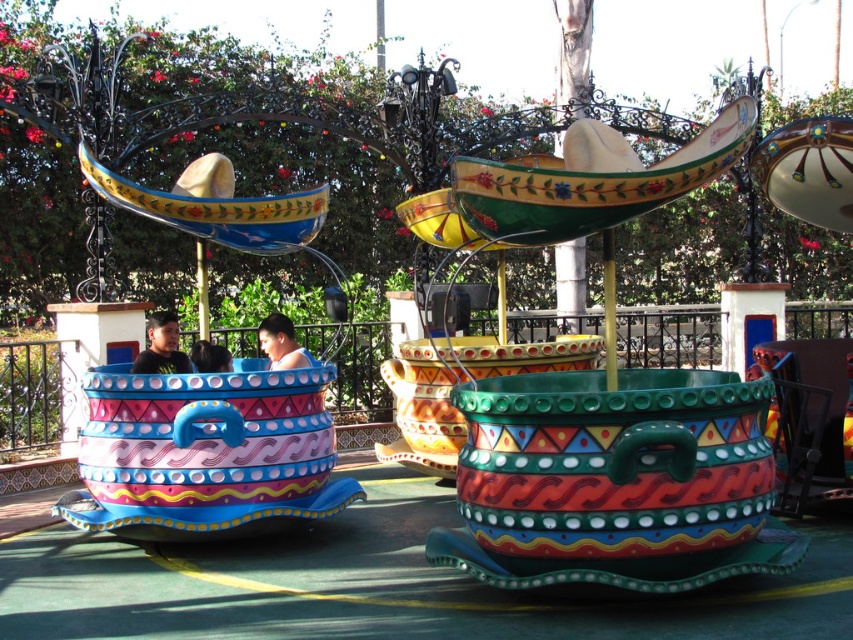
Is matte ceramic teacup at center closer to camera compared to smooth blue shirt at center?

Yes, matte ceramic teacup at center is in front of smooth blue shirt at center.

Does matte ceramic teacup at center come behind smooth blue shirt at center?

No, matte ceramic teacup at center is in front of smooth blue shirt at center.

Image resolution: width=853 pixels, height=640 pixels. Identify the location of matte ceramic teacup at center. (608, 404).

Can you confirm if matte black shirt at left is thinner than smooth blue shirt at center?

Yes, matte black shirt at left is thinner than smooth blue shirt at center.

Which is more to the right, matte black shirt at left or smooth blue shirt at center?

Positioned to the right is smooth blue shirt at center.

At what (x,y) coordinates should I click in order to perform the action: click on matte black shirt at left. Please return your answer as a coordinate pair (x, y). Looking at the image, I should click on pyautogui.click(x=161, y=346).

Which of these two, matte ceramic teacup at center or matte black shirt at left, stands taller?

matte ceramic teacup at center is taller.

Does matte ceramic teacup at center have a lesser height compared to matte black shirt at left?

No.

Consider the image. Who is more forward, (733, 534) or (166, 316)?

Point (733, 534) is in front.

Find the location of a particular element. matte ceramic teacup at center is located at coordinates (608, 404).